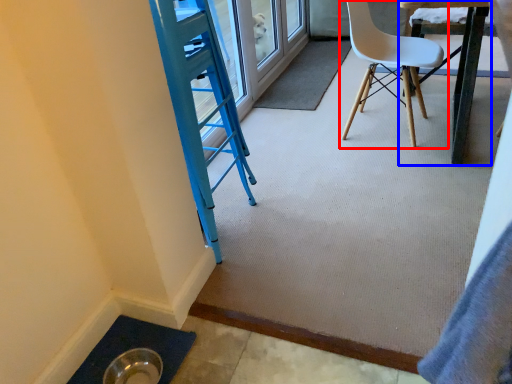
Question: Which point is further to the camera, chair (highlighted by a red box) or table (highlighted by a blue box)?

Choices:
 (A) chair
 (B) table

Answer: (A)